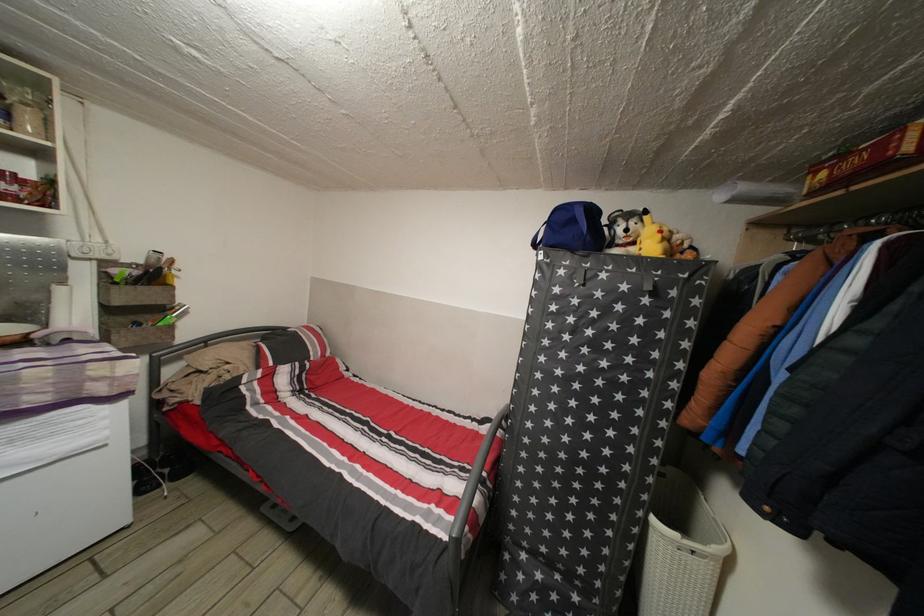
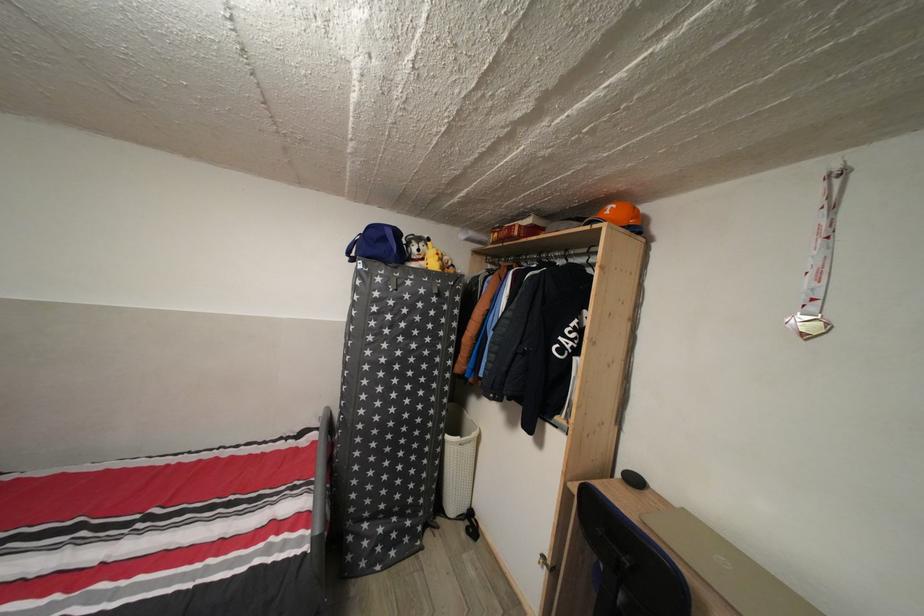
Where in the second image is the point corresponding to [661,525] from the first image?

(455, 444)